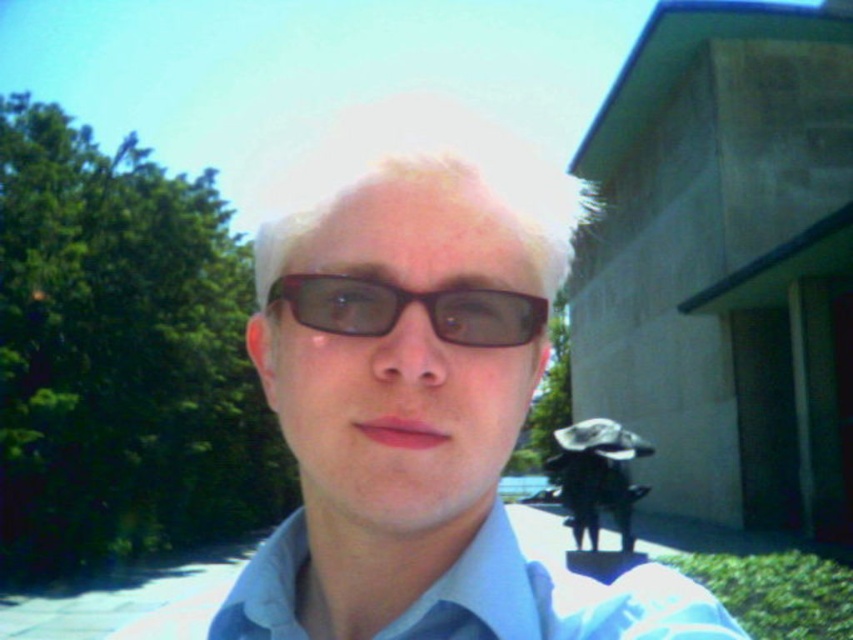
Question: Which object is the farthest from the matte brown glasses at center?

Choices:
 (A) shiny brown glasses at center
 (B) white cotton dress shirt at center

Answer: (B)

Question: Is white cotton dress shirt at center below shiny brown glasses at center?

Choices:
 (A) no
 (B) yes

Answer: (B)

Question: Does white cotton dress shirt at center have a greater width compared to shiny brown glasses at center?

Choices:
 (A) yes
 (B) no

Answer: (A)

Question: Which point is closer to the camera?

Choices:
 (A) (316, 308)
 (B) (407, 484)

Answer: (B)

Question: Does matte brown glasses at center have a greater width compared to blonde hair at center?

Choices:
 (A) no
 (B) yes

Answer: (A)

Question: Among these objects, which one is nearest to the camera?

Choices:
 (A) shiny brown glasses at center
 (B) matte brown glasses at center
 (C) blonde hair at center

Answer: (B)